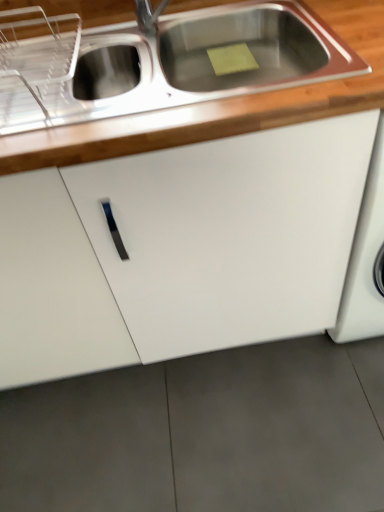
Question: In terms of width, does wooden countertop at upper center look wider or thinner when compared to white matte cabinet at center?

Choices:
 (A) wide
 (B) thin

Answer: (B)

Question: Is wooden countertop at upper center spatially inside white matte cabinet at center, or outside of it?

Choices:
 (A) outside
 (B) inside

Answer: (B)

Question: Considering their positions, is wooden countertop at upper center located in front of or behind white matte cabinet at center?

Choices:
 (A) front
 (B) behind

Answer: (A)

Question: Considering the positions of point (211, 225) and point (360, 39), is point (211, 225) closer or farther from the camera than point (360, 39)?

Choices:
 (A) closer
 (B) farther

Answer: (A)

Question: Is white matte cabinet at center to the left or to the right of wooden countertop at upper center in the image?

Choices:
 (A) right
 (B) left

Answer: (B)

Question: Considering their positions, is white matte cabinet at center located in front of or behind wooden countertop at upper center?

Choices:
 (A) behind
 (B) front

Answer: (A)

Question: From the image's perspective, is white matte cabinet at center located above or below wooden countertop at upper center?

Choices:
 (A) above
 (B) below

Answer: (B)